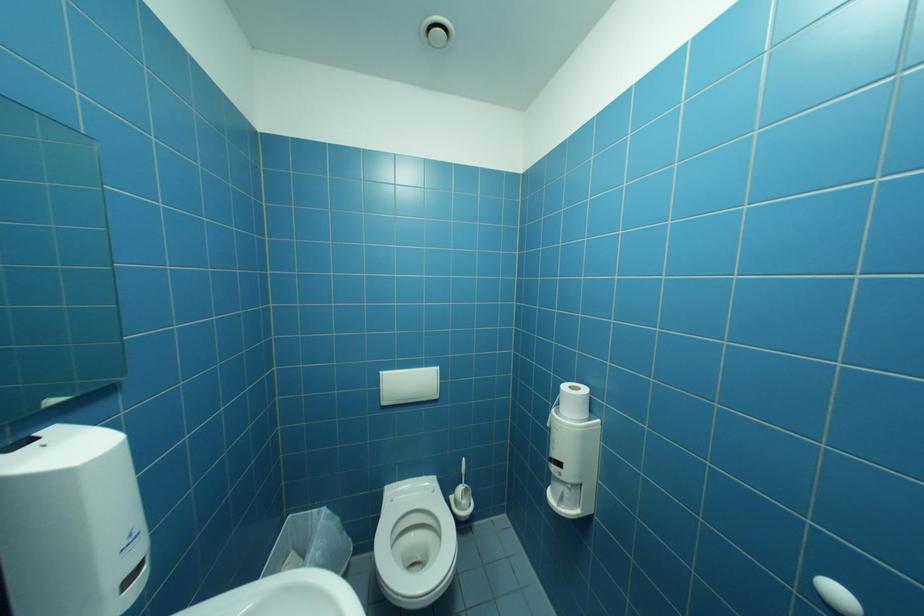
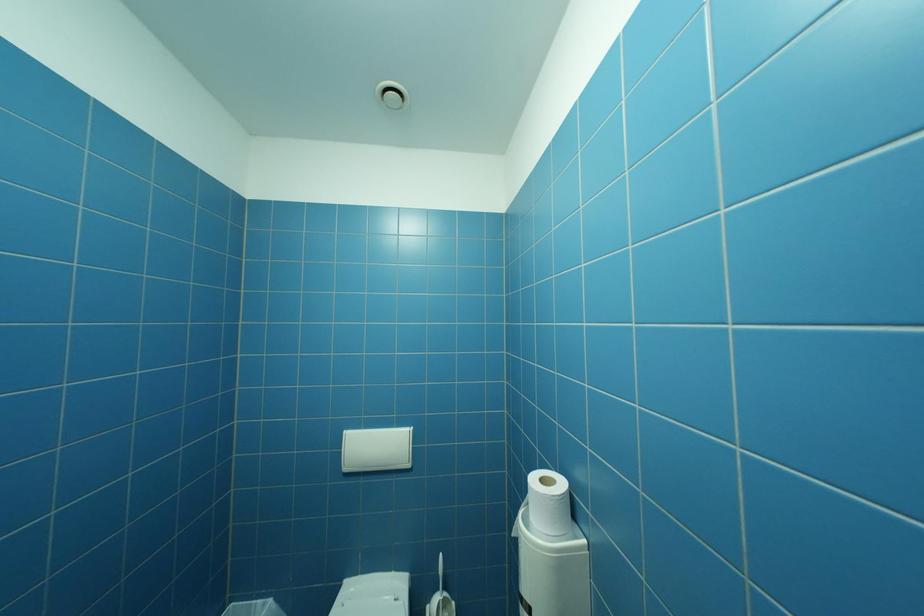
Question: The camera is either moving clockwise (left) or counter-clockwise (right) around the object. The first image is from the beginning of the video and the second image is from the end. Is the camera moving left or right when shooting the video?

Choices:
 (A) Left
 (B) Right

Answer: (B)